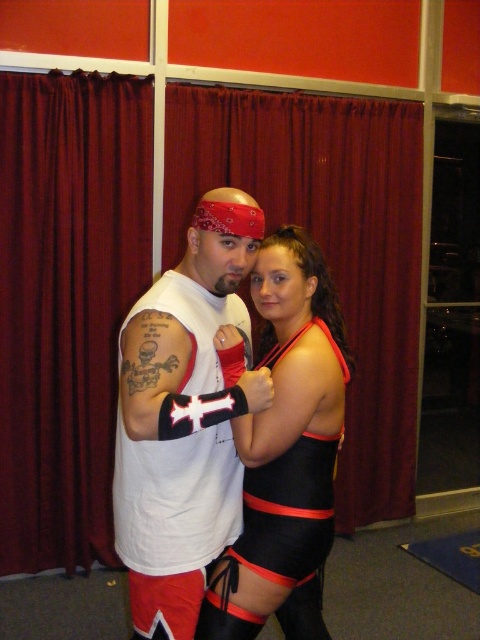
Which is below, red velvet curtain at center or white matte tank top at center?

white matte tank top at center

Identify the location of red velvet curtain at center. The height and width of the screenshot is (640, 480). coord(66,305).

Who is positioned more to the left, white matte tank top at center or black matte wrestling outfit at center?

white matte tank top at center is more to the left.

Is white matte tank top at center bigger than black matte wrestling outfit at center?

Yes, white matte tank top at center is bigger than black matte wrestling outfit at center.

This screenshot has width=480, height=640. What are the coordinates of `white matte tank top at center` in the screenshot? It's located at (183, 419).

Is red velvet curtain at center to the left of black matte wrestling outfit at center from the viewer's perspective?

Yes, red velvet curtain at center is to the left of black matte wrestling outfit at center.

Between red velvet curtain at center and black matte wrestling outfit at center, which one has more height?

red velvet curtain at center is taller.

Which is behind, point (55, 188) or point (288, 324)?

Point (55, 188)

The width and height of the screenshot is (480, 640). I want to click on red velvet curtain at center, so click(66, 305).